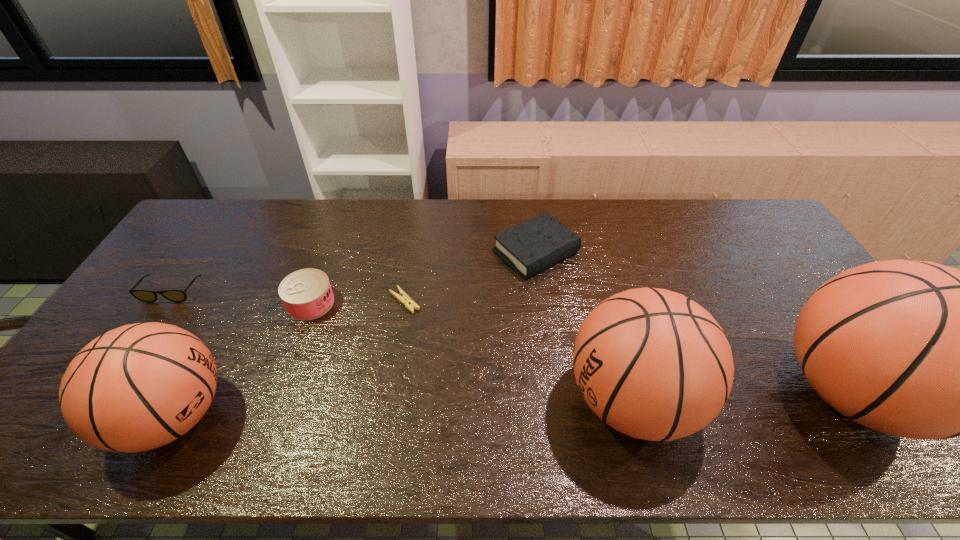
Locate an element on the screen. The width and height of the screenshot is (960, 540). spot to insert another basketball for uniform distribution is located at coordinates (406, 408).